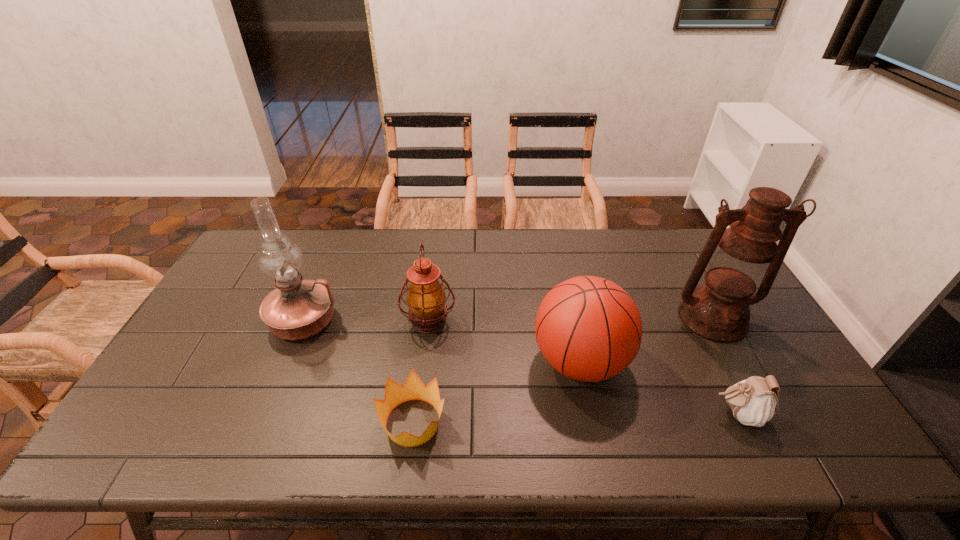
This screenshot has height=540, width=960. Identify the location of the rightmost oil lamp. (738, 260).

You are a GUI agent. You are given a task and a screenshot of the screen. Output one action in this format:
    pyautogui.click(x=<x>, y=<y>)
    Task: Click on the leftmost object
    
    Given the screenshot: What is the action you would take?
    pyautogui.click(x=297, y=309)

Locate an element on the screen. the shortest oil lamp is located at coordinates (426, 299).

Where is `basketball`? This screenshot has height=540, width=960. basketball is located at coordinates (588, 328).

I want to click on pouch, so click(754, 401).

This screenshot has width=960, height=540. What are the coordinates of `the shortest object` in the screenshot? It's located at 413,389.

Identify the location of free space located on the front of the rightmost oil lamp. Image resolution: width=960 pixels, height=540 pixels. click(x=776, y=433).

Identify the location of vacant space located on the left of the leftmost oil lamp. The height and width of the screenshot is (540, 960). (226, 321).

Locate an element on the screen. free space located 0.100m on the left of the shortest oil lamp is located at coordinates (367, 322).

Locate an element on the screen. free space located on the back of the fourth object from left to right is located at coordinates (556, 247).